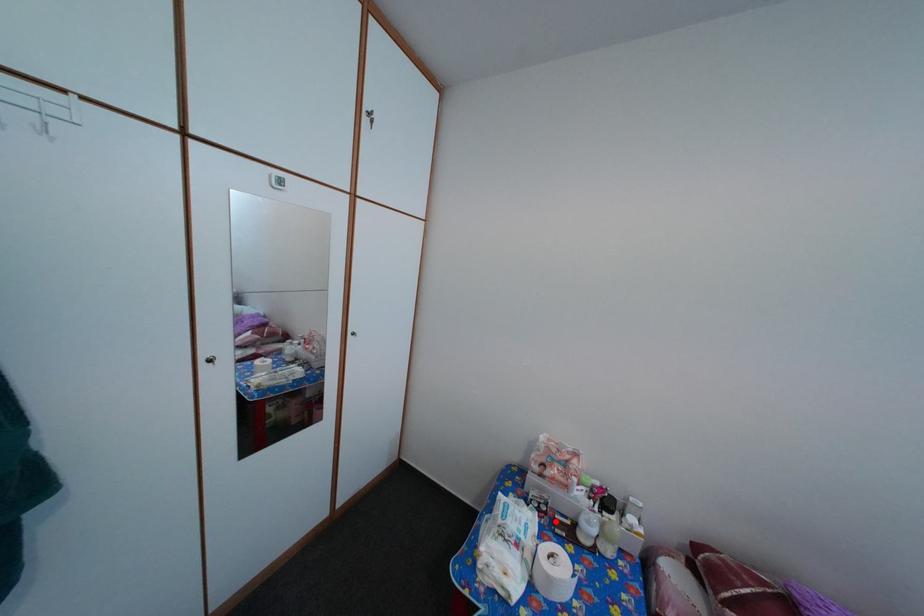
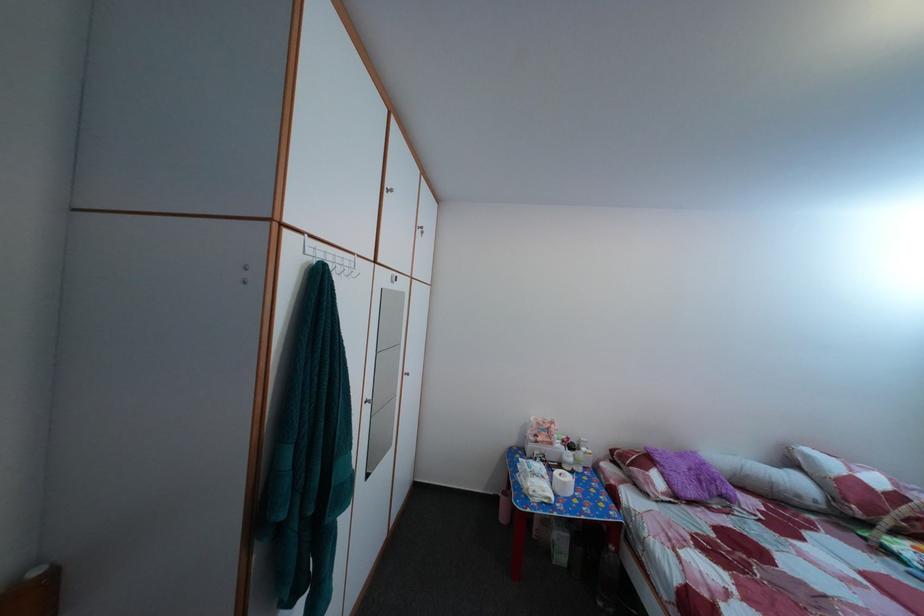
Find the pixel in the second image that matches the highlighted location in the first image.

(555, 469)